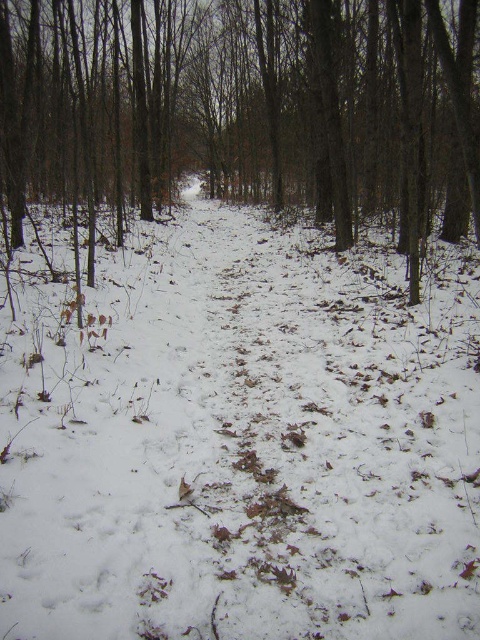
You are a hiker trying to cross the forest path. You see the white powdery snow at center and the brown matte tree at center. Which object is located to the right side of the other?

The white powdery snow at center is to the right of the brown matte tree at center.

You are standing in the winter forest scene and want to walk from the point closer to you to the point further away. Which path should you take between the two points, point (177, 241) and point (302, 129)?

You should walk from point (177, 241) to point (302, 129) because point (177, 241) is closer to the viewer and point (302, 129) is further away.